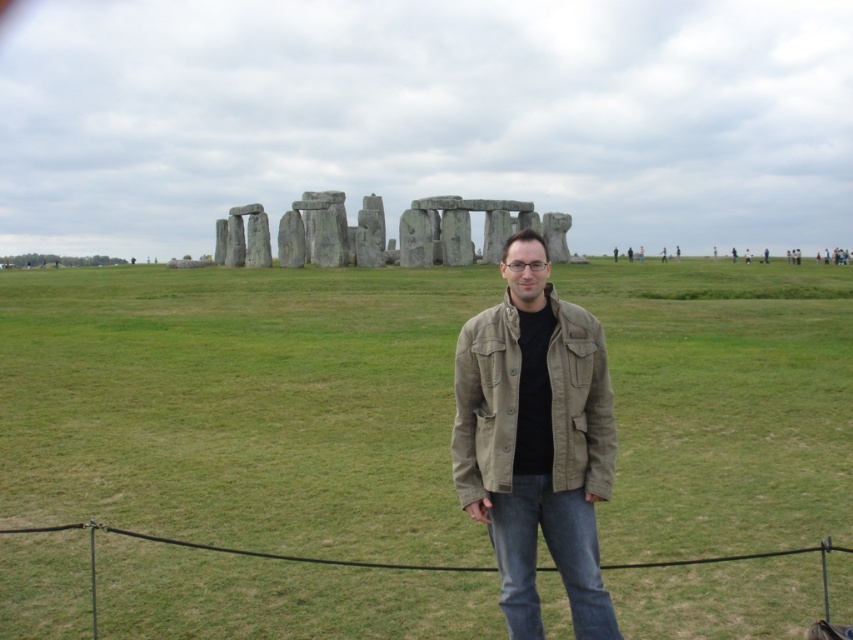
Does green grassy field at center appear under khaki cotton jacket at center?

Incorrect, green grassy field at center is not positioned below khaki cotton jacket at center.

Which is more to the left, green grassy field at center or khaki cotton jacket at center?

Positioned to the left is green grassy field at center.

Image resolution: width=853 pixels, height=640 pixels. What do you see at coordinates (241, 404) in the screenshot?
I see `green grassy field at center` at bounding box center [241, 404].

Where is `green grassy field at center`? green grassy field at center is located at coordinates (241, 404).